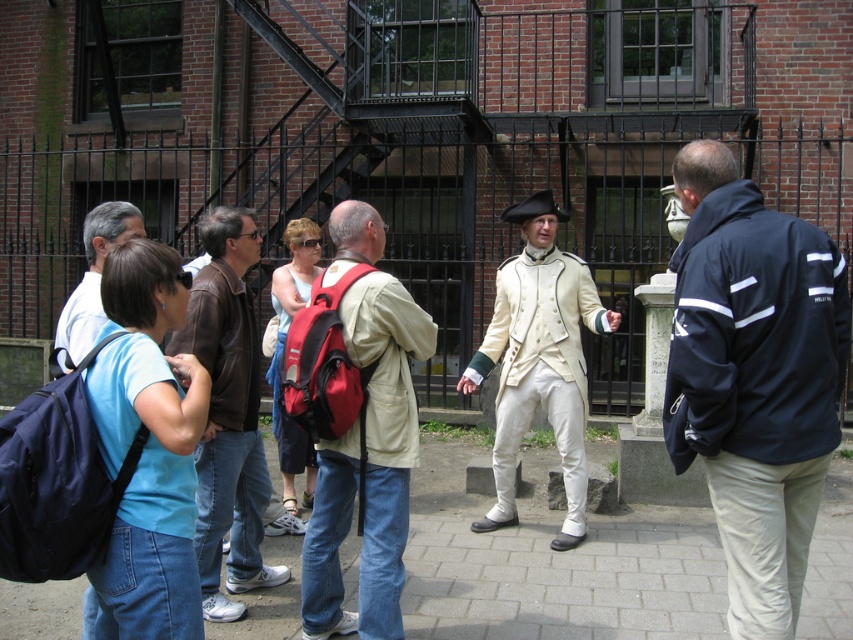
Question: Estimate the real-world distances between objects in this image. Which object is farther from the blue fabric shirt at left?

Choices:
 (A) blue fabric shirt at center
 (B) navy blue jacket at center
 (C) light beige fabric coat at center
 (D) brown leather jacket at left

Answer: (C)

Question: Can you confirm if blue fabric shirt at center is positioned to the left of light beige fabric coat at center?

Choices:
 (A) no
 (B) yes

Answer: (B)

Question: Considering the real-world distances, which object is farthest from the light beige fabric coat at center?

Choices:
 (A) matte beige coat at center
 (B) brown leather jacket at left
 (C) matte red backpack at center

Answer: (B)

Question: Does blue fabric shirt at center appear on the left side of blue fabric shirt at left?

Choices:
 (A) yes
 (B) no

Answer: (B)

Question: Which point is closer to the camera?

Choices:
 (A) brown leather jacket at left
 (B) light beige fabric coat at center
 (C) matte beige coat at center
 (D) matte red backpack at center

Answer: (C)

Question: Is navy blue jacket at center above blue fabric shirt at center?

Choices:
 (A) yes
 (B) no

Answer: (A)